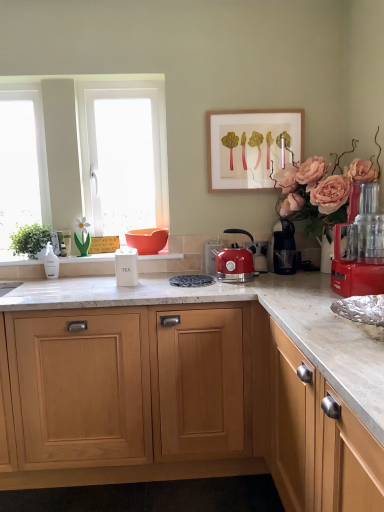
What do you see at coordinates (30, 240) in the screenshot?
I see `green leafy plant at left` at bounding box center [30, 240].

The height and width of the screenshot is (512, 384). What do you see at coordinates (22, 161) in the screenshot?
I see `white glass window at left` at bounding box center [22, 161].

What is the approximate width of matte red coffee machine at center, positioned as the 1th coffee machine in back-to-front order?

matte red coffee machine at center, positioned as the 1th coffee machine in back-to-front order, is 0.82 inches in width.

What are the coordinates of `matte red coffee machine at center, the 2th coffee machine when ordered from front to back` in the screenshot? It's located at (259, 254).

Identify the location of metallic silver toaster at center, which appears as the second kitchen appliance when viewed from the back. (211, 256).

The width and height of the screenshot is (384, 512). Describe the element at coordinates (126, 267) in the screenshot. I see `white matte tea container at center, the second kitchen appliance in the left-to-right sequence` at that location.

This screenshot has width=384, height=512. I want to click on white glossy bottle at left, acting as the fifth kitchen appliance starting from the front, so click(x=51, y=263).

How much space does white glossy bottle at left, which appears as the 5th kitchen appliance when viewed from the right, occupy horizontally?

The width of white glossy bottle at left, which appears as the 5th kitchen appliance when viewed from the right, is 1.79 inches.

Identify the location of green leafy plant at left. The height and width of the screenshot is (512, 384). (30, 240).

From a real-world perspective, is white matte tea container at center, acting as the 4th kitchen appliance starting from the right, beneath black plastic coffee machine at right, the 1th coffee machine positioned from the front?

Yes, from a real-world perspective, white matte tea container at center, acting as the 4th kitchen appliance starting from the right, is beneath black plastic coffee machine at right, the 1th coffee machine positioned from the front.

Which is in front, white matte tea container at center, which ranks as the third kitchen appliance in back-to-front order, or black plastic coffee machine at right, the 2th coffee machine from the back?

Positioned in front is white matte tea container at center, which ranks as the third kitchen appliance in back-to-front order.

Is black plastic coffee machine at right, the 2th coffee machine from the back, inside white matte tea container at center, the 3th kitchen appliance in the front-to-back sequence?

Definitely not — black plastic coffee machine at right, the 2th coffee machine from the back, is not inside white matte tea container at center, the 3th kitchen appliance in the front-to-back sequence.

Does point (124, 256) come in front of point (275, 262)?

That is False.

Between metallic silver toaster at center, which appears as the second kitchen appliance when viewed from the back, and white glossy bottle at left, which appears as the 5th kitchen appliance when viewed from the right, which one is positioned behind?

white glossy bottle at left, which appears as the 5th kitchen appliance when viewed from the right, is more distant.

Is point (215, 270) behind point (48, 256)?

No, (215, 270) is in front of (48, 256).

Is metallic silver toaster at center, the 3th kitchen appliance when ordered from left to right, not near white glossy bottle at left, positioned as the first kitchen appliance in back-to-front order?

No, metallic silver toaster at center, the 3th kitchen appliance when ordered from left to right, is not far from white glossy bottle at left, positioned as the first kitchen appliance in back-to-front order.

Who is taller, light wood cabinet at center or white glossy bottle at left, positioned as the first kitchen appliance in back-to-front order?

Standing taller between the two is light wood cabinet at center.

Considering the positions of points (162, 396) and (55, 260), is point (162, 396) farther from camera compared to point (55, 260)?

No, (162, 396) is in front of (55, 260).

Could you tell me if light wood cabinet at center is facing white glossy bottle at left, positioned as the first kitchen appliance in back-to-front order?

No, light wood cabinet at center is not facing towards white glossy bottle at left, positioned as the first kitchen appliance in back-to-front order.

From a real-world perspective, is light wood cabinet at center positioned under white glossy bottle at left, acting as the fifth kitchen appliance starting from the front, based on gravity?

Indeed, from a real-world perspective, light wood cabinet at center is positioned beneath white glossy bottle at left, acting as the fifth kitchen appliance starting from the front.

Is wooden picture frame at upper center not near green leafy plant at left?

Yes, wooden picture frame at upper center is far from green leafy plant at left.

Which object is closer to the camera, wooden picture frame at upper center or green leafy plant at left?

Positioned in front is green leafy plant at left.

This screenshot has width=384, height=512. I want to click on plant lying in front of the wooden picture frame at upper center, so 30,240.

Looking at this image, can you confirm if wooden picture frame at upper center is taller than green leafy plant at left?

Yes, wooden picture frame at upper center is taller than green leafy plant at left.

How many degrees apart are the facing directions of green leafy plant at left and wooden picture frame at upper center?

0.438 degrees.

Looking at this image, is green leafy plant at left far away from wooden picture frame at upper center?

Yes, green leafy plant at left is far from wooden picture frame at upper center.

Which object is further away from the camera taking this photo, green leafy plant at left or wooden picture frame at upper center?

wooden picture frame at upper center is further away from the camera.

Is green leafy plant at left wider or thinner than wooden picture frame at upper center?

Considering their sizes, green leafy plant at left looks broader than wooden picture frame at upper center.

Where is `the 2nd kitchen appliance to the left of the matte red kettle at center, the 2th kitchen appliance positioned from the right, starting your count from the anchor`? This screenshot has width=384, height=512. the 2nd kitchen appliance to the left of the matte red kettle at center, the 2th kitchen appliance positioned from the right, starting your count from the anchor is located at coordinates (126, 267).

From their relative heights in the image, would you say white matte tea container at center, the 3th kitchen appliance in the front-to-back sequence, is taller or shorter than matte red kettle at center, the 2th kitchen appliance positioned from the right?

In the image, white matte tea container at center, the 3th kitchen appliance in the front-to-back sequence, appears to be shorter than matte red kettle at center, the 2th kitchen appliance positioned from the right.

Looking at this image, which point is more distant from viewer, (131, 280) or (230, 271)?

Positioned behind is point (131, 280).

From the image's perspective, is white matte tea container at center, which ranks as the third kitchen appliance in back-to-front order, located above or below matte red kettle at center, the 2th kitchen appliance positioned from the right?

white matte tea container at center, which ranks as the third kitchen appliance in back-to-front order, is below matte red kettle at center, the 2th kitchen appliance positioned from the right.

Which of these two, light wood cabinet at center or black plastic coffee machine at right, the 2th coffee machine from the back, stands taller?

light wood cabinet at center is taller.

Considering the sizes of light wood cabinet at center and black plastic coffee machine at right, the 1th coffee machine positioned from the front, in the image, is light wood cabinet at center wider or thinner than black plastic coffee machine at right, the 1th coffee machine positioned from the front,?

Considering their sizes, light wood cabinet at center looks broader than black plastic coffee machine at right, the 1th coffee machine positioned from the front.

Which is behind, point (240, 463) or point (282, 229)?

The point (282, 229) is farther from the camera.

How different are the orientations of light wood cabinet at center and black plastic coffee machine at right, the 1th coffee machine positioned from the front, in degrees?

The angular difference between light wood cabinet at center and black plastic coffee machine at right, the 1th coffee machine positioned from the front, is 0.455 degrees.

Which coffee machine is the 1st one when counting from the back of the white matte tea container at center, the 3th kitchen appliance in the front-to-back sequence? Please provide its 2D coordinates.

[(285, 249)]

There is a white glossy bottle at left, which appears as the 5th kitchen appliance when viewed from the right. Identify the location of the 1st kitchen appliance above it (from a real-world perspective). The width and height of the screenshot is (384, 512). (211, 256).

From the picture: From the image, which object appears to be nearer to green leafy plant at left, matte red coffee machine at center, the 2th coffee machine when ordered from front to back, or wooden picture frame at upper center?

Based on the image, wooden picture frame at upper center appears to be nearer to green leafy plant at left.

When comparing their distances from white frosted glass at left, does matte red coffee machine at center, positioned as the 1th coffee machine in back-to-front order, or metallic red food processor at right, the 1th kitchen appliance when ordered from right to left, seem closer?

Among the two, matte red coffee machine at center, positioned as the 1th coffee machine in back-to-front order, is located nearer to white frosted glass at left.

From the picture: Estimate the real-world distances between objects in this image. Which object is closer to white matte tea container at center, which ranks as the third kitchen appliance in back-to-front order, wooden picture frame at upper center or white glossy window sill at center?

The object closer to white matte tea container at center, which ranks as the third kitchen appliance in back-to-front order, is white glossy window sill at center.

Estimate the real-world distances between objects in this image. Which object is closer to green leafy plant at left, blue speckled plate at center or white frosted glass at left?

white frosted glass at left.

From the image, which object appears to be farther from white glossy bottle at left, which appears as the 5th kitchen appliance when viewed from the right, white matte tea container at center, the 3th kitchen appliance in the front-to-back sequence, or metallic silver toaster at center, which appears as the second kitchen appliance when viewed from the back?

The object further to white glossy bottle at left, which appears as the 5th kitchen appliance when viewed from the right, is metallic silver toaster at center, which appears as the second kitchen appliance when viewed from the back.

When comparing their distances from metallic red food processor at right, the fifth kitchen appliance in the back-to-front sequence, does white frosted glass at left or white glass window at left seem closer?

The object closer to metallic red food processor at right, the fifth kitchen appliance in the back-to-front sequence, is white frosted glass at left.

From the image, which object appears to be farther from blue speckled plate at center, white glossy bottle at left, which is the 1th kitchen appliance from left to right, or white glossy window sill at center?

white glossy bottle at left, which is the 1th kitchen appliance from left to right, lies further to blue speckled plate at center than the other object.

Based on the photo, based on their spatial positions, is matte red kettle at center, the 4th kitchen appliance from the back, or blue speckled plate at center closer to white matte tea container at center, which ranks as the third kitchen appliance in back-to-front order?

blue speckled plate at center is positioned closer to the anchor white matte tea container at center, which ranks as the third kitchen appliance in back-to-front order.

Where is `cabinetry located between white glass window at left and matte red coffee machine at center, positioned as the 1th coffee machine in back-to-front order, in the left-right direction`? The image size is (384, 512). cabinetry located between white glass window at left and matte red coffee machine at center, positioned as the 1th coffee machine in back-to-front order, in the left-right direction is located at coordinates (191, 387).

This screenshot has height=512, width=384. Find the location of `kitchen appliance between green leafy plant at left and white matte tea container at center, the second kitchen appliance in the left-to-right sequence, in the horizontal direction`. kitchen appliance between green leafy plant at left and white matte tea container at center, the second kitchen appliance in the left-to-right sequence, in the horizontal direction is located at coordinates (51, 263).

At what (x,y) coordinates should I click in order to perform the action: click on cabinetry located between white matte tea container at center, which ranks as the third kitchen appliance in back-to-front order, and matte red coffee machine at center, positioned as the 1th coffee machine in back-to-front order, in the left-right direction. Please return your answer as a coordinate pair (x, y). This screenshot has width=384, height=512. Looking at the image, I should click on (191, 387).

Find the location of a particular element. window screen between white glass window at left and black plastic coffee machine at right, the 1th coffee machine positioned from the front, in the horizontal direction is located at coordinates (124, 154).